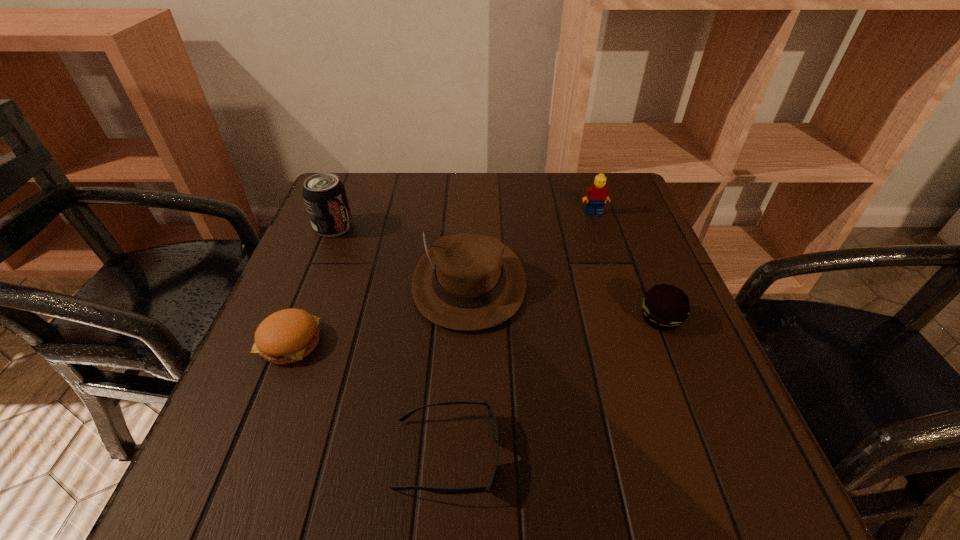
Locate an element on the screen. free space located 0.070m on the feather side of the fedora is located at coordinates (467, 365).

This screenshot has height=540, width=960. Identify the location of vacant space located on the front of the soda can. (283, 352).

Where is `vacant space situated on the front-facing side of the third tallest object`? Image resolution: width=960 pixels, height=540 pixels. vacant space situated on the front-facing side of the third tallest object is located at coordinates (603, 240).

This screenshot has width=960, height=540. I want to click on vacant space located on the back of the taller patty, so click(x=639, y=266).

Find the location of a particular element. Image resolution: width=960 pixels, height=540 pixels. vacant area located 0.200m on the right of the left patty is located at coordinates (429, 342).

In order to click on vacant area located 0.170m on the front-facing side of the sunglasses in this screenshot , I will do `click(612, 455)`.

Where is `soda can positioned at the far edge`? soda can positioned at the far edge is located at coordinates (324, 194).

You are a GUI agent. You are given a task and a screenshot of the screen. Output one action in this format:
    pyautogui.click(x=<x>, y=<y>)
    Task: Click on the Lego positioned at the far edge
    Image resolution: width=960 pixels, height=540 pixels.
    Given the screenshot: What is the action you would take?
    pyautogui.click(x=598, y=193)

Identify the location of object present at the near edge. (491, 417).

Find the location of a particular element. soda can that is at the left edge is located at coordinates (324, 194).